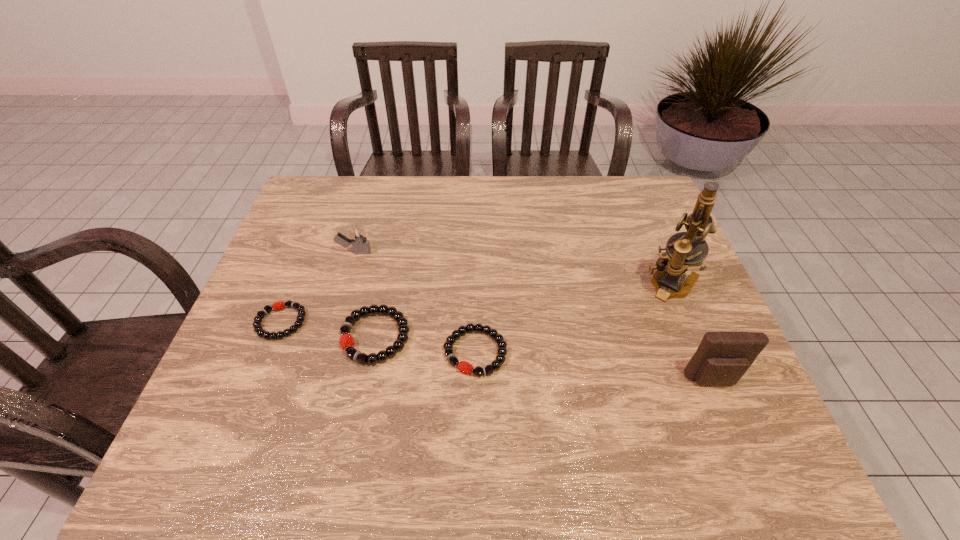
Find the location of a particular element. The height and width of the screenshot is (540, 960). vacant area at the near edge of the desktop is located at coordinates (622, 391).

At what (x,y) coordinates should I click in order to perform the action: click on free region at the left edge of the desktop. Please return your answer as a coordinate pair (x, y). Image resolution: width=960 pixels, height=540 pixels. Looking at the image, I should click on (305, 236).

Image resolution: width=960 pixels, height=540 pixels. Identify the location of vacant space at the right edge of the desktop. (682, 280).

Find the location of `vacant space at the far left corner of the desktop`. vacant space at the far left corner of the desktop is located at coordinates (322, 182).

You are a GUI agent. You are given a task and a screenshot of the screen. Output one action in this format:
    pyautogui.click(x=<x>, y=<y>)
    Task: Click on the vacant region at the near left corner of the desktop
    This screenshot has height=540, width=960.
    Given the screenshot: What is the action you would take?
    pyautogui.click(x=269, y=416)

The width and height of the screenshot is (960, 540). I want to click on free space at the far right corner, so click(x=626, y=185).

This screenshot has height=540, width=960. Find the location of `vacant space at the near right corner of the desktop`. vacant space at the near right corner of the desktop is located at coordinates (686, 415).

Where is `empty space that is in between the pouch and the second bracelet from right to left`? This screenshot has width=960, height=540. empty space that is in between the pouch and the second bracelet from right to left is located at coordinates (544, 359).

Where is `free space between the second bracelet from left to right and the pouch`? The height and width of the screenshot is (540, 960). free space between the second bracelet from left to right and the pouch is located at coordinates (544, 359).

Image resolution: width=960 pixels, height=540 pixels. Identify the location of vacant point located between the second shortest bracelet and the second bracelet from left to right. (425, 345).